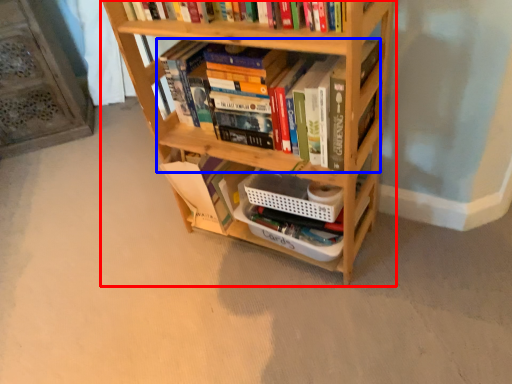
Question: Which object appears closest to the camera in this image, bookcase (highlighted by a red box) or book (highlighted by a blue box)?

Choices:
 (A) bookcase
 (B) book

Answer: (A)